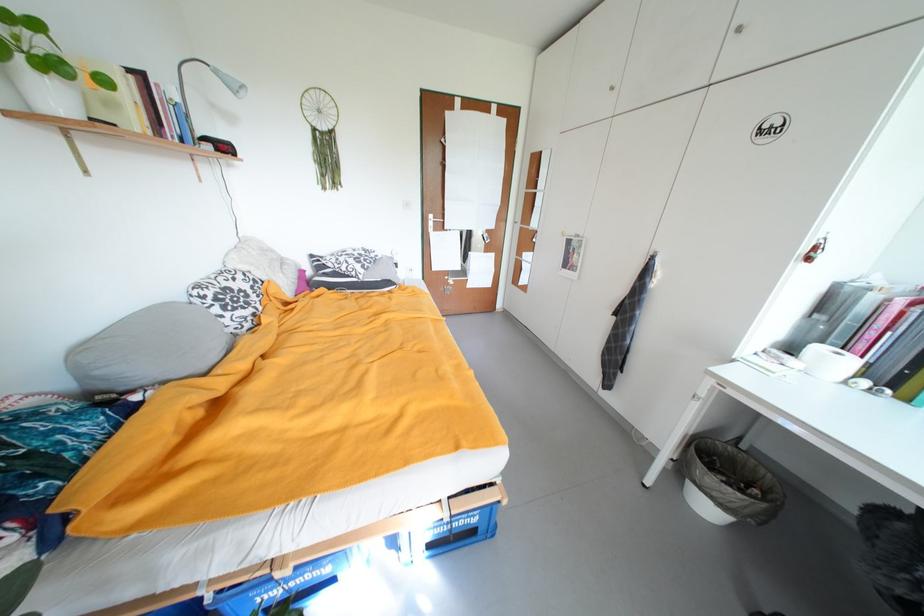
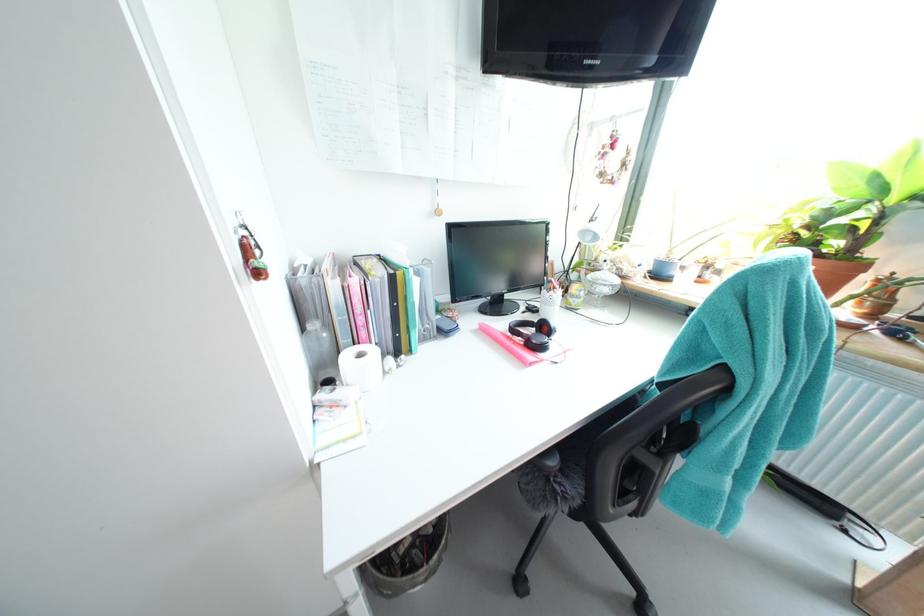
The first image is from the beginning of the video and the second image is from the end. How did the camera likely rotate when shooting the video?

The camera's rotation is toward right-down.